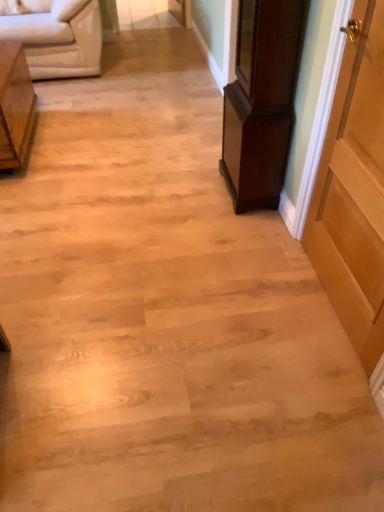
Question: Is light brown wood side table at left, the 1th furniture when ordered from left to right, completely or partially outside of dark wood cabinet at right, which ranks as the 2th furniture in left-to-right order?

Choices:
 (A) no
 (B) yes

Answer: (B)

Question: Does light brown wood side table at left, the 1th furniture when ordered from left to right, have a greater height compared to dark wood cabinet at right, which is counted as the first furniture, starting from the right?

Choices:
 (A) no
 (B) yes

Answer: (A)

Question: Is the depth of light brown wood side table at left, marked as the 2th furniture in a right-to-left arrangement, greater than that of dark wood cabinet at right, which ranks as the 2th furniture in left-to-right order?

Choices:
 (A) no
 (B) yes

Answer: (B)

Question: From a real-world perspective, is light brown wood side table at left, marked as the 2th furniture in a right-to-left arrangement, physically below dark wood cabinet at right, which is counted as the first furniture, starting from the right?

Choices:
 (A) no
 (B) yes

Answer: (B)

Question: From the image's perspective, is light brown wood side table at left, marked as the 2th furniture in a right-to-left arrangement, under dark wood cabinet at right, which is counted as the first furniture, starting from the right?

Choices:
 (A) yes
 (B) no

Answer: (B)

Question: Does light brown wood side table at left, marked as the 2th furniture in a right-to-left arrangement, appear on the left side of dark wood cabinet at right, which ranks as the 2th furniture in left-to-right order?

Choices:
 (A) yes
 (B) no

Answer: (A)

Question: Is dark wood cabinet at right, which ranks as the 2th furniture in left-to-right order, positioned far away from white leather studio couch at upper left?

Choices:
 (A) no
 (B) yes

Answer: (B)

Question: Is dark wood cabinet at right, which ranks as the 2th furniture in left-to-right order, thinner than white leather studio couch at upper left?

Choices:
 (A) yes
 (B) no

Answer: (A)

Question: Could you tell me if dark wood cabinet at right, which ranks as the 2th furniture in left-to-right order, is turned towards white leather studio couch at upper left?

Choices:
 (A) no
 (B) yes

Answer: (A)

Question: Is white leather studio couch at upper left surrounded by dark wood cabinet at right, which is counted as the first furniture, starting from the right?

Choices:
 (A) yes
 (B) no

Answer: (B)

Question: Does dark wood cabinet at right, which is counted as the first furniture, starting from the right, have a lesser height compared to white leather studio couch at upper left?

Choices:
 (A) no
 (B) yes

Answer: (A)

Question: Is dark wood cabinet at right, which ranks as the 2th furniture in left-to-right order, at the right side of white leather studio couch at upper left?

Choices:
 (A) no
 (B) yes

Answer: (B)

Question: Can you confirm if dark wood cabinet at right, which ranks as the 2th furniture in left-to-right order, is positioned to the left of light brown wood door at right?

Choices:
 (A) no
 (B) yes

Answer: (B)